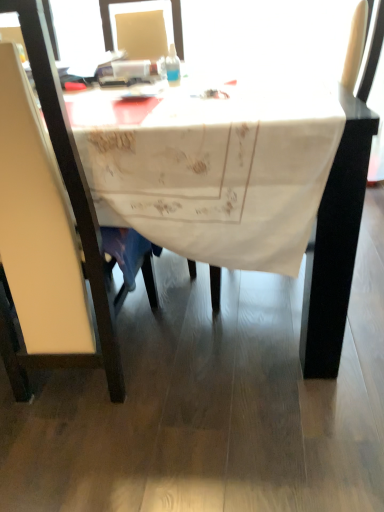
Question: Should I look upward or downward to see transparent plastic bottle at center?

Choices:
 (A) down
 (B) up

Answer: (B)

Question: Is transparent plastic bottle at center thinner than white leather chair at left?

Choices:
 (A) no
 (B) yes

Answer: (B)

Question: Is transparent plastic bottle at center not close to white leather chair at left?

Choices:
 (A) yes
 (B) no

Answer: (B)

Question: Is transparent plastic bottle at center to the left of white leather chair at left from the viewer's perspective?

Choices:
 (A) yes
 (B) no

Answer: (B)

Question: Does transparent plastic bottle at center have a smaller size compared to white leather chair at left?

Choices:
 (A) yes
 (B) no

Answer: (A)

Question: Considering the relative positions of transparent plastic bottle at center and white leather chair at left in the image provided, is transparent plastic bottle at center to the right of white leather chair at left from the viewer's perspective?

Choices:
 (A) no
 (B) yes

Answer: (B)

Question: From a real-world perspective, is transparent plastic bottle at center positioned over white leather chair at left based on gravity?

Choices:
 (A) no
 (B) yes

Answer: (B)

Question: Is white embroidered tablecloth at center beside transparent plastic bottle at center?

Choices:
 (A) yes
 (B) no

Answer: (B)

Question: Is white embroidered tablecloth at center thinner than transparent plastic bottle at center?

Choices:
 (A) no
 (B) yes

Answer: (A)

Question: Is white embroidered tablecloth at center turned away from transparent plastic bottle at center?

Choices:
 (A) no
 (B) yes

Answer: (A)

Question: From the image's perspective, is white embroidered tablecloth at center above transparent plastic bottle at center?

Choices:
 (A) yes
 (B) no

Answer: (B)

Question: From a real-world perspective, does white embroidered tablecloth at center stand above transparent plastic bottle at center?

Choices:
 (A) no
 (B) yes

Answer: (A)

Question: Can you confirm if white embroidered tablecloth at center is bigger than transparent plastic bottle at center?

Choices:
 (A) yes
 (B) no

Answer: (A)

Question: From a real-world perspective, is white leather chair at left positioned over white embroidered tablecloth at center based on gravity?

Choices:
 (A) yes
 (B) no

Answer: (A)